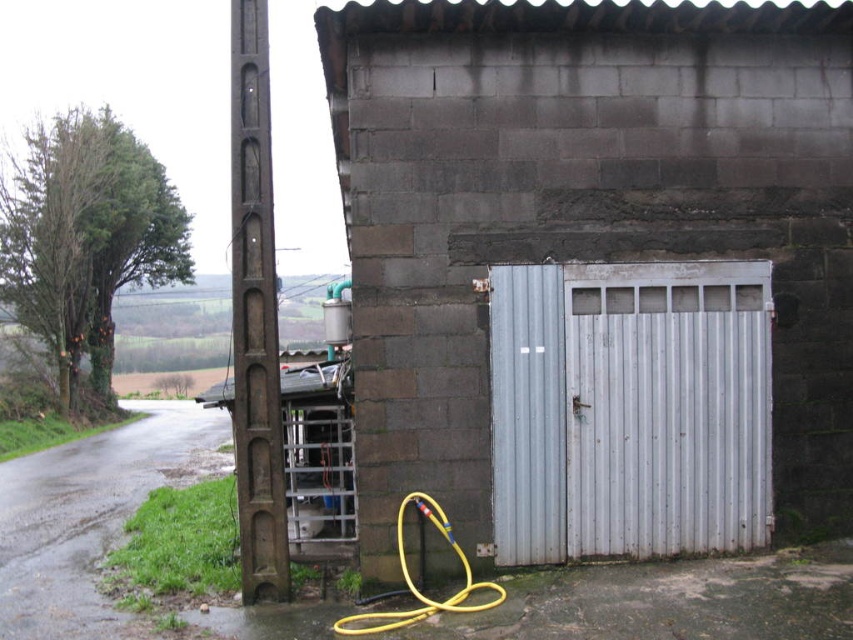
You are a delivery driver approaching the wet asphalt road at lower left and the yellow rubber garden hose at lower center. Which object is closer to the front of the weathered stone building with a corrugated metal garage door?

The yellow rubber garden hose at lower center is closer to the front of the weathered stone building with a corrugated metal garage door because the wet asphalt road at lower left is positioned under it, indicating it is further away.

You are a delivery person trying to park a truck that is 2 meters wide. The truck needs to fit between the white corrugated metal garage door at center and the yellow rubber garden hose at lower center. Can the truck fit based on their widths?

The white corrugated metal garage door at center is wider than the yellow rubber garden hose at lower center. However, the exact widths are not provided, so it is impossible to determine if the truck can fit without additional measurements.

You are standing at the base of the tall wooden post in front of the stone building. Looking towards the lower left corner of the image, there is a point marked at coordinates (90, 516). What is located at this point?

The point at (90, 516) marks the location of the wet asphalt road at lower left.